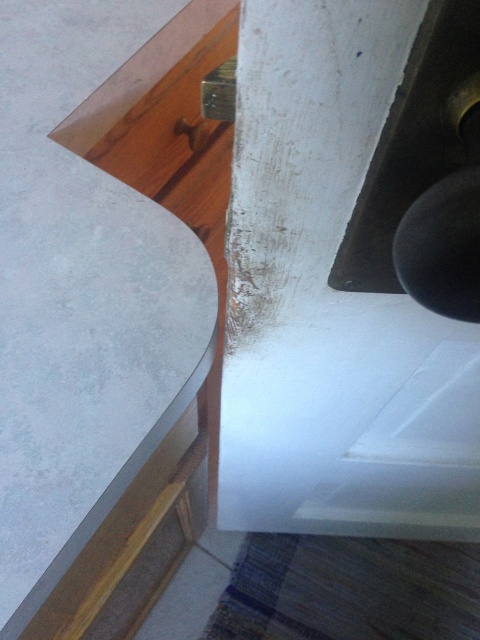
Does matte concrete countertop at center have a lesser height compared to matte wood drawer at lower left?

In fact, matte concrete countertop at center may be taller than matte wood drawer at lower left.

Is point (2, 445) in front of point (109, 540)?

Yes, point (2, 445) is closer to viewer.

Where is `matte concrete countertop at center`? This screenshot has height=640, width=480. matte concrete countertop at center is located at coordinates (81, 294).